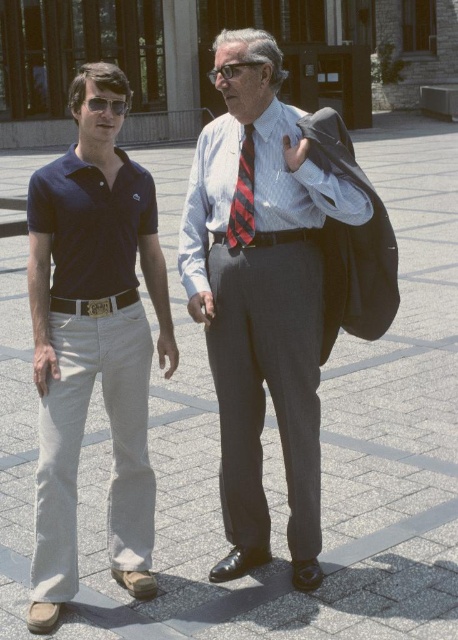
Who is higher up, navy cotton polo at left or matte black sunglasses at left?

Positioned higher is matte black sunglasses at left.

Which is below, navy cotton polo at left or matte black sunglasses at left?

navy cotton polo at left is below.

What do you see at coordinates (92, 224) in the screenshot? I see `navy cotton polo at left` at bounding box center [92, 224].

What are the coordinates of `navy cotton polo at left` in the screenshot? It's located at (92, 224).

Who is positioned more to the left, white textured dress shirt at center or red striped tie at center?

From the viewer's perspective, red striped tie at center appears more on the left side.

Which is above, white textured dress shirt at center or red striped tie at center?

red striped tie at center is above.

Locate an element on the screen. white textured dress shirt at center is located at coordinates (298, 180).

Which is behind, point (195, 161) or point (98, 102)?

Positioned behind is point (195, 161).

Which is below, white textured dress shirt at center or matte black sunglasses at left?

white textured dress shirt at center is below.

Is point (191, 236) positioned behind point (98, 96)?

That is True.

Image resolution: width=458 pixels, height=640 pixels. I want to click on white textured dress shirt at center, so click(298, 180).